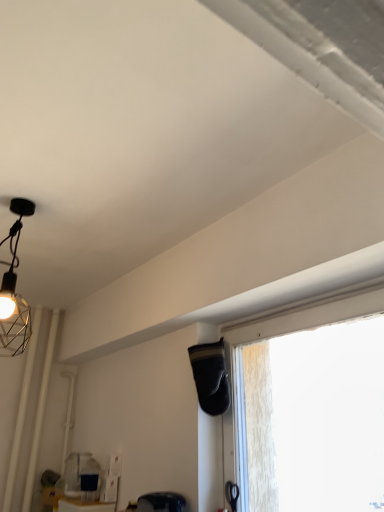
Question: Considering the relative positions of transparent glass window at center and matte black swivel chair at lower center in the image provided, is transparent glass window at center behind matte black swivel chair at lower center?

Choices:
 (A) no
 (B) yes

Answer: (A)

Question: Is transparent glass window at center smaller than matte black swivel chair at lower center?

Choices:
 (A) no
 (B) yes

Answer: (A)

Question: From a real-world perspective, does transparent glass window at center sit lower than matte black swivel chair at lower center?

Choices:
 (A) yes
 (B) no

Answer: (B)

Question: From the image's perspective, does transparent glass window at center appear lower than matte black swivel chair at lower center?

Choices:
 (A) yes
 (B) no

Answer: (B)

Question: Considering the relative sizes of transparent glass window at center and matte black swivel chair at lower center in the image provided, is transparent glass window at center bigger than matte black swivel chair at lower center?

Choices:
 (A) yes
 (B) no

Answer: (A)

Question: Considering the relative sizes of transparent glass window at center and matte black swivel chair at lower center in the image provided, is transparent glass window at center wider than matte black swivel chair at lower center?

Choices:
 (A) no
 (B) yes

Answer: (A)

Question: Is matte black swivel chair at lower center oriented away from transparent glass window at center?

Choices:
 (A) yes
 (B) no

Answer: (B)

Question: Can you confirm if matte black swivel chair at lower center is bigger than transparent glass window at center?

Choices:
 (A) no
 (B) yes

Answer: (A)

Question: Is matte black swivel chair at lower center to the right of transparent glass window at center from the viewer's perspective?

Choices:
 (A) yes
 (B) no

Answer: (B)

Question: Is transparent glass window at center completely or partially inside matte black swivel chair at lower center?

Choices:
 (A) no
 (B) yes

Answer: (A)

Question: From a real-world perspective, does matte black swivel chair at lower center stand above transparent glass window at center?

Choices:
 (A) yes
 (B) no

Answer: (B)

Question: Does matte black swivel chair at lower center turn towards transparent glass window at center?

Choices:
 (A) no
 (B) yes

Answer: (A)

Question: Based on their positions, is transparent glass window at center located to the left or right of matte black swivel chair at lower center?

Choices:
 (A) right
 (B) left

Answer: (A)